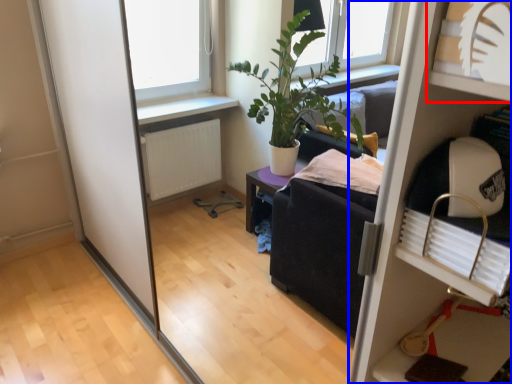
Question: Which point is further to the camera, shelf (highlighted by a red box) or shelf (highlighted by a blue box)?

Choices:
 (A) shelf
 (B) shelf

Answer: (B)